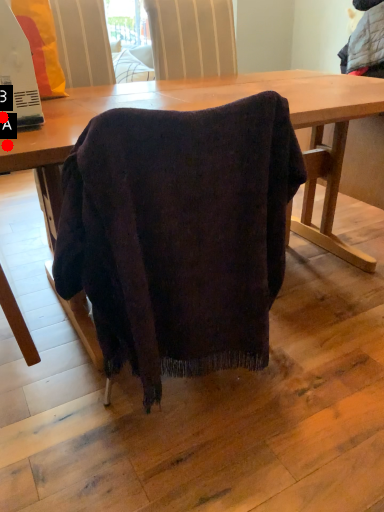
Question: Two points are circled on the image, labeled by A and B beside each circle. Which point is further to the camera?

Choices:
 (A) A is further
 (B) B is further

Answer: (B)